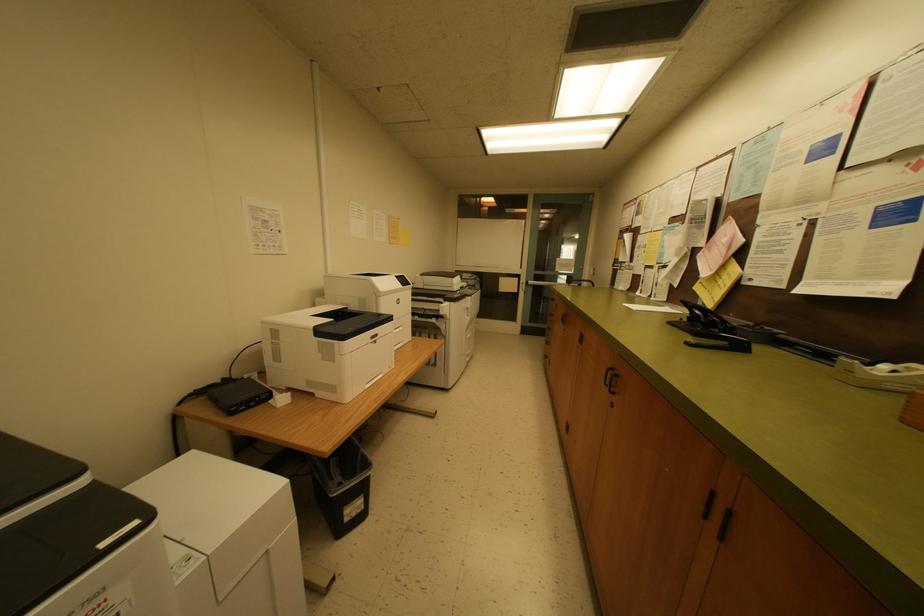
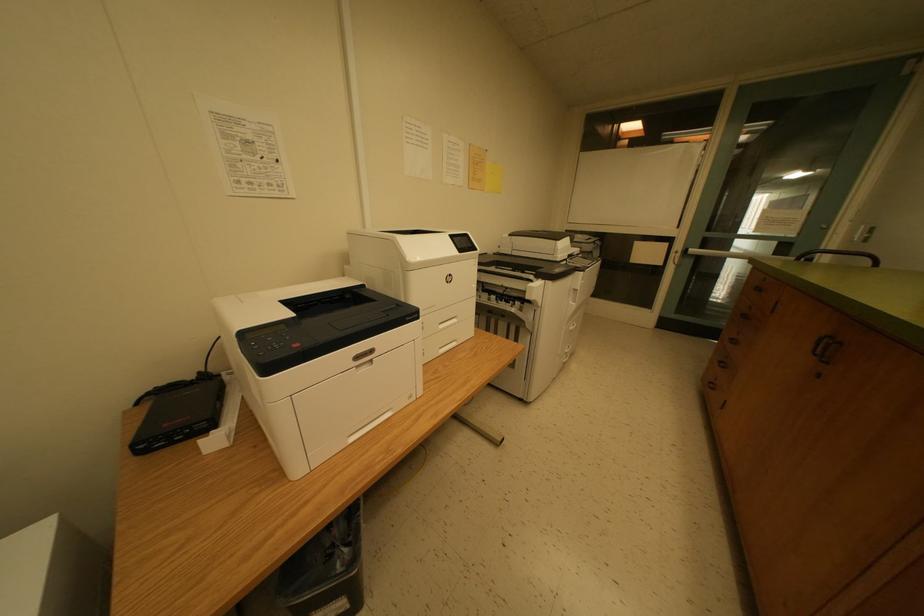
Question: The camera is either moving clockwise (left) or counter-clockwise (right) around the object. The first image is from the beginning of the video and the second image is from the end. Is the camera moving left or right when shooting the video?

Choices:
 (A) Left
 (B) Right

Answer: (B)